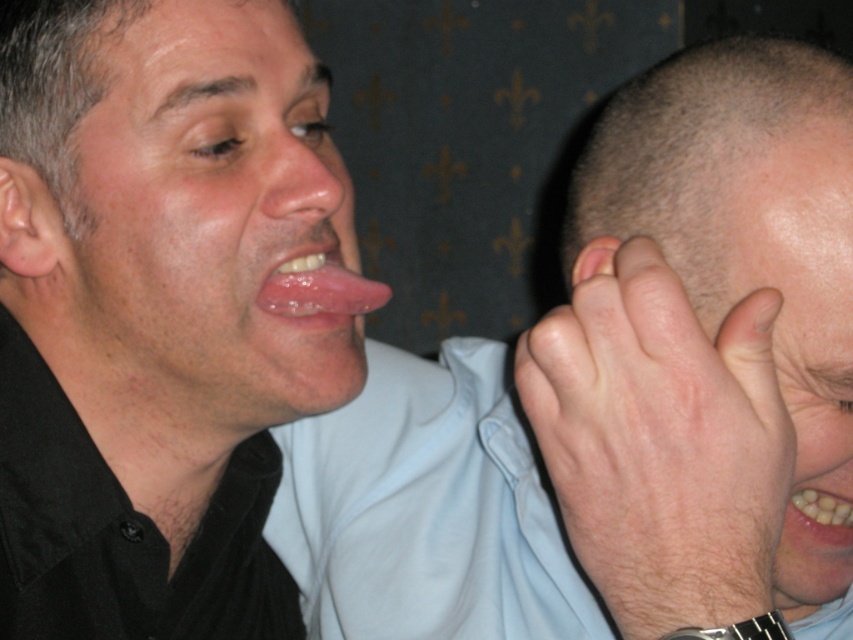
Question: Is smooth skin nose at center below glossy pink tongue at center?

Choices:
 (A) yes
 (B) no

Answer: (B)

Question: Among these points, which one is nearest to the camera?

Choices:
 (A) (631, 472)
 (B) (821, 124)
 (C) (306, 180)
 (D) (599, 243)

Answer: (A)

Question: Which object appears farthest from the camera in this image?

Choices:
 (A) light brown hair at right
 (B) pink flesh/soft tissue ear at left

Answer: (B)

Question: Based on their relative distances, which object is farther from the glossy skin face at center?

Choices:
 (A) light brown hair at right
 (B) pink flesh at center
 (C) pink flesh/soft tissue ear at left

Answer: (A)

Question: Observing the image, what is the correct spatial positioning of smooth skin nose at center in reference to pink flesh at center?

Choices:
 (A) left
 (B) right

Answer: (A)

Question: From the image, what is the correct spatial relationship of matte skin hand at center in relation to glossy pink tongue at center?

Choices:
 (A) left
 (B) right

Answer: (B)